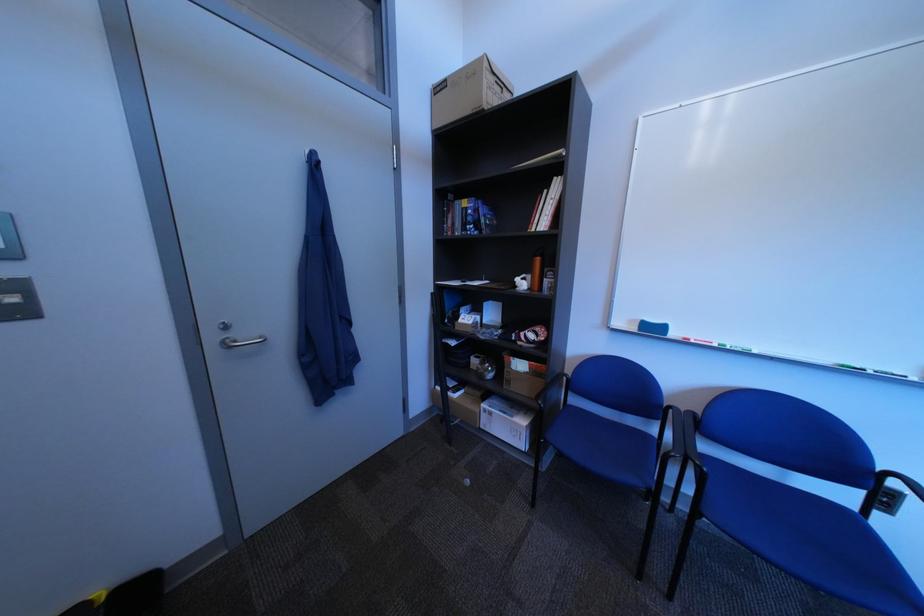
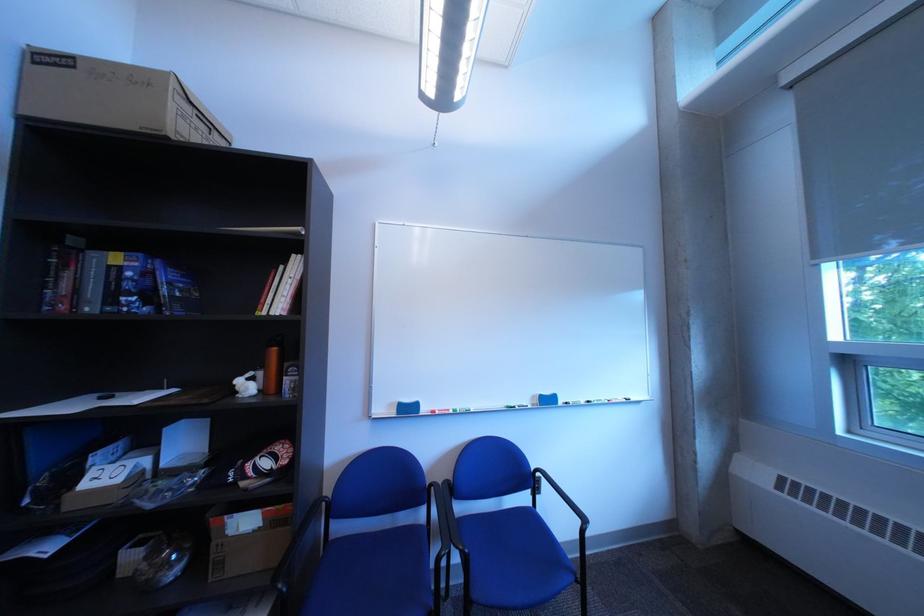
Locate, in the second image, the point that corresponds to [487,228] in the first image.

(150, 300)